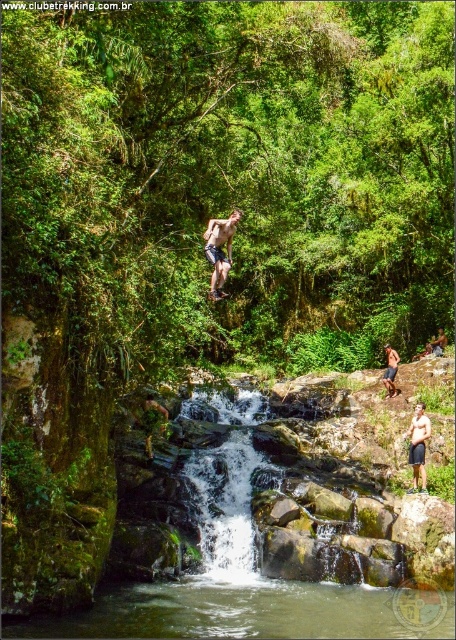
Question: Observing the image, what is the correct spatial positioning of green mossy rocks at center in reference to smooth skin man at center?

Choices:
 (A) below
 (B) above

Answer: (A)

Question: Which object is positioned closest to the green mossy rocks at center?

Choices:
 (A) shiny metallic shorts at center
 (B) skinny white man at lower right

Answer: (B)

Question: Which is farther from the shiny metallic shorts at center?

Choices:
 (A) smooth skin man at center
 (B) skinny white man at lower right

Answer: (A)

Question: Is green mossy rocks at center below smooth skin man at center?

Choices:
 (A) yes
 (B) no

Answer: (A)

Question: From the image, what is the correct spatial relationship of green mossy rocks at center in relation to tan skin human at center?

Choices:
 (A) above
 (B) below

Answer: (B)

Question: Which point is farther to the camera?

Choices:
 (A) (445, 342)
 (B) (223, 234)
 (C) (388, 344)

Answer: (C)